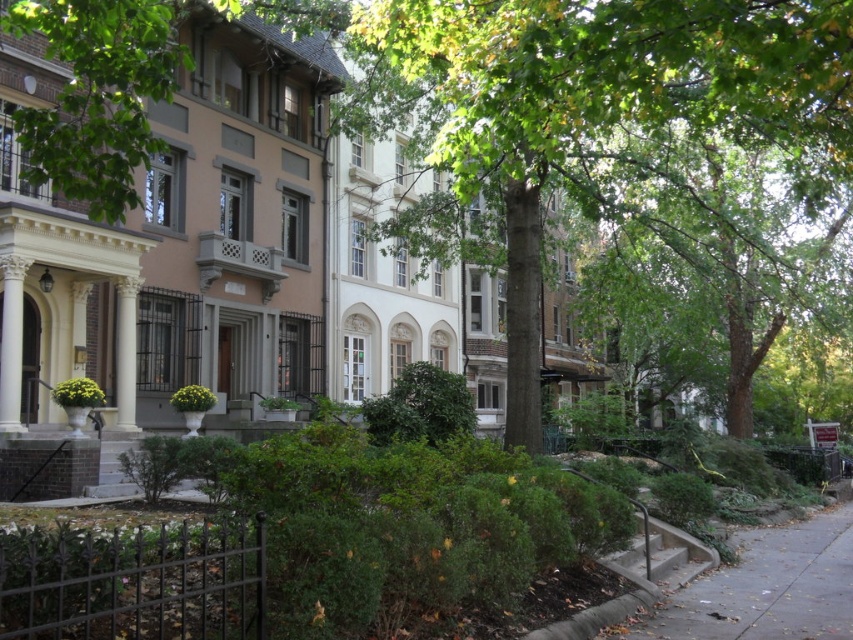
Question: Can you confirm if green leafy tree at center is wider than gray concrete sidewalk at lower right?

Choices:
 (A) yes
 (B) no

Answer: (A)

Question: Is green leafy tree at center positioned behind gray concrete sidewalk at lower right?

Choices:
 (A) yes
 (B) no

Answer: (B)

Question: Which of the following is the closest to the observer?

Choices:
 (A) (16, 16)
 (B) (695, 593)

Answer: (A)

Question: Considering the relative positions of green leafy tree at center and gray concrete sidewalk at lower right in the image provided, where is green leafy tree at center located with respect to gray concrete sidewalk at lower right?

Choices:
 (A) below
 (B) above

Answer: (B)